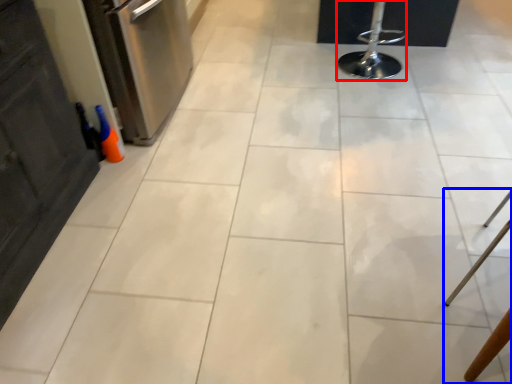
Question: Among these objects, which one is nearest to the camera, bar stool (highlighted by a red box) or furniture (highlighted by a blue box)?

Choices:
 (A) bar stool
 (B) furniture

Answer: (B)